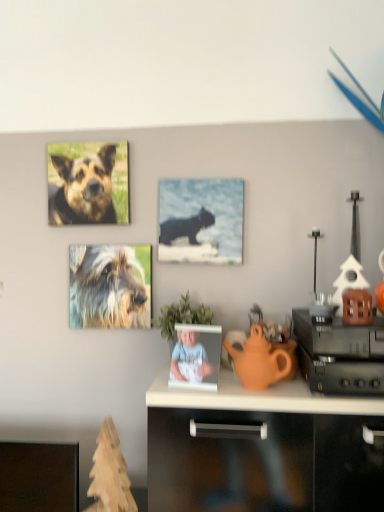
Question: Is orange matte teapot at center oriented towards brown fur dog at upper left, placed as the first dog when sorted from top to bottom?

Choices:
 (A) yes
 (B) no

Answer: (B)

Question: Does orange matte teapot at center have a lesser width compared to brown fur dog at upper left, placed as the first dog when sorted from top to bottom?

Choices:
 (A) no
 (B) yes

Answer: (A)

Question: Considering the relative positions of orange matte teapot at center and brown fur dog at upper left, arranged as the 2th dog when ordered from the bottom, in the image provided, is orange matte teapot at center to the right of brown fur dog at upper left, arranged as the 2th dog when ordered from the bottom, from the viewer's perspective?

Choices:
 (A) no
 (B) yes

Answer: (B)

Question: Are orange matte teapot at center and brown fur dog at upper left, placed as the first dog when sorted from top to bottom, beside each other?

Choices:
 (A) no
 (B) yes

Answer: (A)

Question: From the image's perspective, is orange matte teapot at center located above brown fur dog at upper left, arranged as the 2th dog when ordered from the bottom?

Choices:
 (A) yes
 (B) no

Answer: (B)

Question: From a real-world perspective, relative to smooth plastic photo frame at center, is orange matte teapot at center vertically above or below?

Choices:
 (A) above
 (B) below

Answer: (A)

Question: Considering the relative positions of orange matte teapot at center and smooth plastic photo frame at center in the image provided, is orange matte teapot at center to the left or to the right of smooth plastic photo frame at center?

Choices:
 (A) left
 (B) right

Answer: (B)

Question: Does point [x=246, y=340] appear closer or farther from the camera than point [x=175, y=373]?

Choices:
 (A) farther
 (B) closer

Answer: (A)

Question: Looking at the image, does orange matte teapot at center seem bigger or smaller compared to smooth plastic photo frame at center?

Choices:
 (A) big
 (B) small

Answer: (A)

Question: Which is correct: green leafy plant at center is inside matte black cat at center, or outside of it?

Choices:
 (A) inside
 (B) outside

Answer: (B)

Question: From the image's perspective, is green leafy plant at center located above or below matte black cat at center?

Choices:
 (A) above
 (B) below

Answer: (B)

Question: Does point (208, 317) appear closer or farther from the camera than point (221, 233)?

Choices:
 (A) closer
 (B) farther

Answer: (A)

Question: Is green leafy plant at center taller or shorter than matte black cat at center?

Choices:
 (A) short
 (B) tall

Answer: (A)

Question: Considering their positions, is black plastic speaker at right located in front of or behind green leafy plant at center?

Choices:
 (A) front
 (B) behind

Answer: (A)

Question: Is point (339, 333) positioned closer to the camera than point (192, 322)?

Choices:
 (A) farther
 (B) closer

Answer: (B)